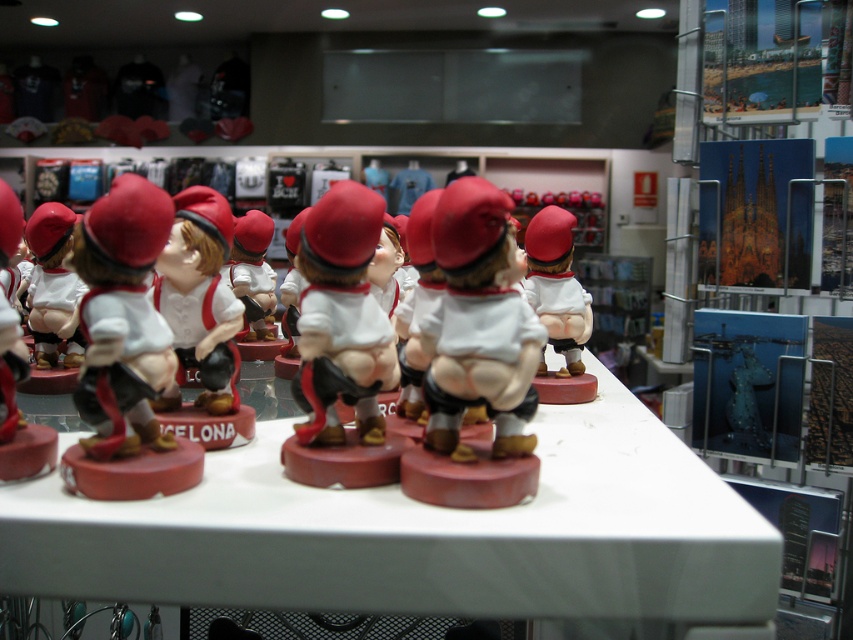
From the picture: Does white glossy table at center have a lesser width compared to matte white figurine at center?

No.

Is point (375, 493) positioned behind point (347, 349)?

That is False.

Identify the location of white glossy table at center. The image size is (853, 640). (425, 536).

Where is `white glossy table at center`? This screenshot has height=640, width=853. white glossy table at center is located at coordinates (425, 536).